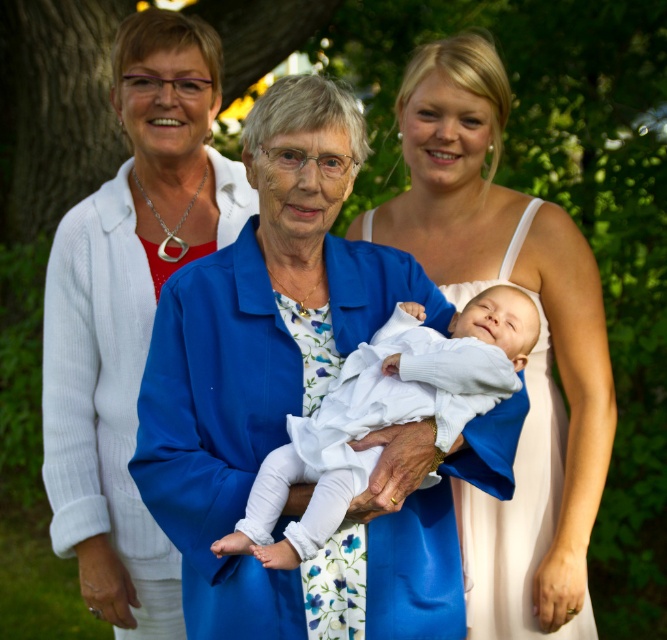
Question: Does white soft fabric baby at center appear under white satin dress at center?

Choices:
 (A) yes
 (B) no

Answer: (B)

Question: Which object is the farthest from the white soft fabric baby at center?

Choices:
 (A) white satin dress at center
 (B) white satin jacket at left

Answer: (B)

Question: Which is farther from the white satin dress at center?

Choices:
 (A) white satin jacket at left
 (B) white soft fabric baby at center

Answer: (A)

Question: Which of the following is the closest to the observer?

Choices:
 (A) (530, 305)
 (B) (65, 296)
 (C) (542, 337)

Answer: (A)

Question: Is white satin jacket at left wider than white soft fabric baby at center?

Choices:
 (A) no
 (B) yes

Answer: (A)

Question: Is white satin jacket at left above white satin dress at center?

Choices:
 (A) yes
 (B) no

Answer: (A)